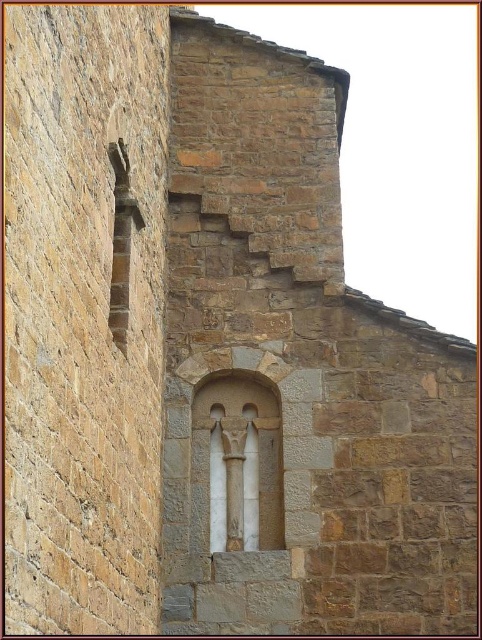
You are an architect inspecting the historical building. You notice the white marble window at center and the white stone column at center. Which object is positioned higher in the structure?

The white marble window at center is located above the white stone column at center, so it is positioned higher in the structure.

You are an architect examining the stone wall and notice the white marble window at center and the white stone column at center. Which of these two elements has a greater height?

The white stone column at center is taller than the white marble window at center.